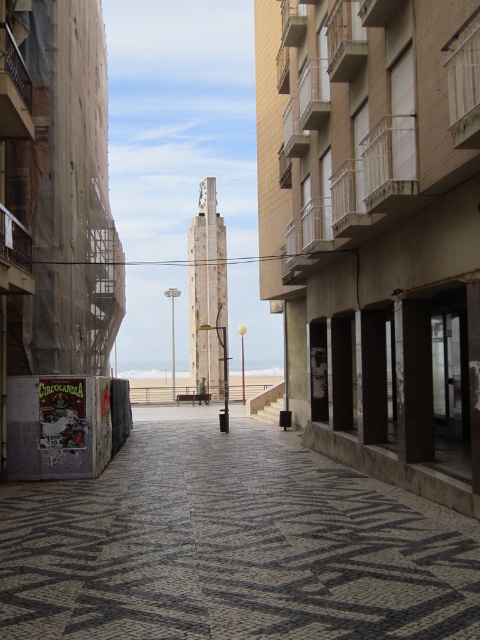
Question: Does black textured pavement at center come behind white sand at center?

Choices:
 (A) no
 (B) yes

Answer: (A)

Question: Can you confirm if black textured pavement at center is positioned below white sand at center?

Choices:
 (A) no
 (B) yes

Answer: (A)

Question: Does black textured pavement at center have a greater width compared to white sand at center?

Choices:
 (A) yes
 (B) no

Answer: (B)

Question: Among these objects, which one is farthest from the camera?

Choices:
 (A) white sand at center
 (B) black textured pavement at center

Answer: (A)

Question: Which point is closer to the camera?

Choices:
 (A) black textured pavement at center
 (B) white sand at center

Answer: (A)